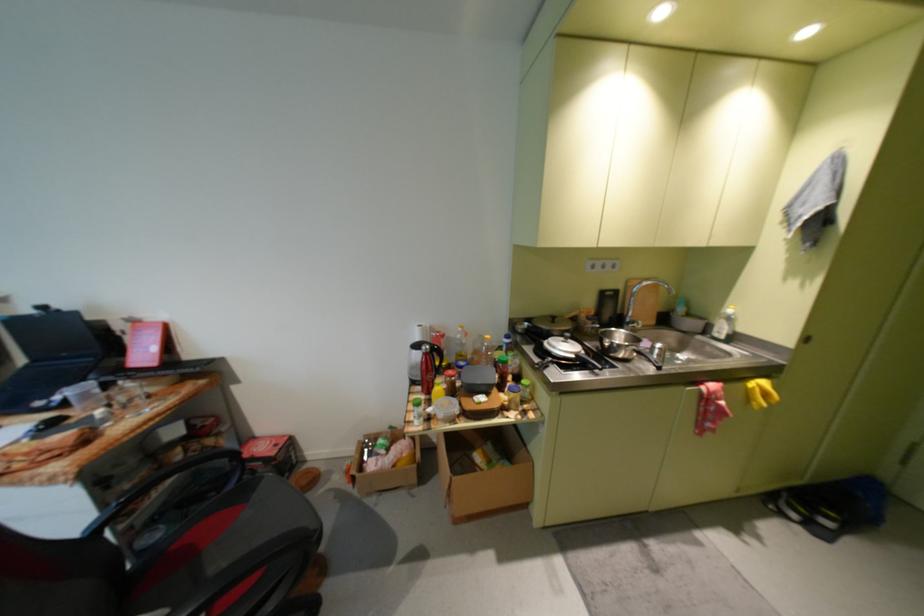
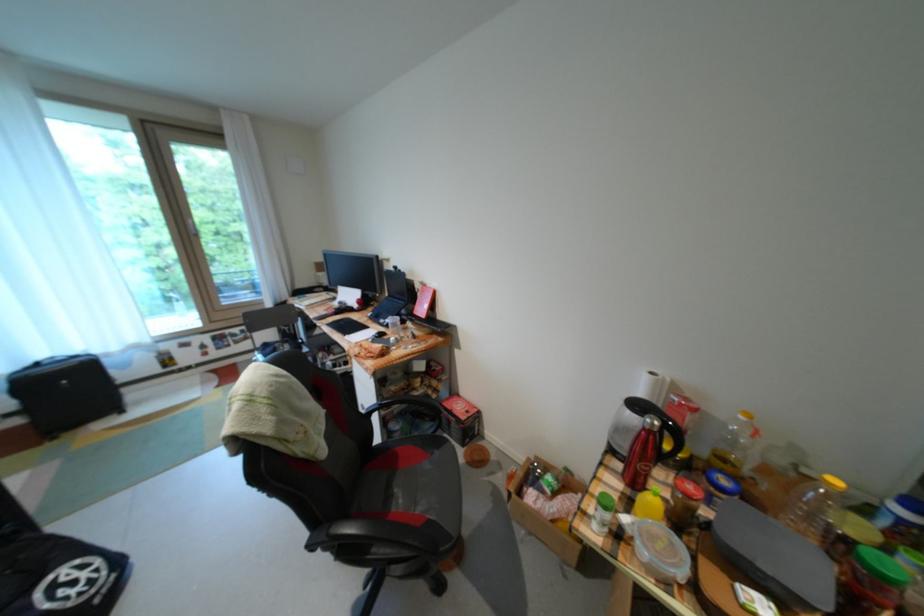
Where in the second image is the point corresponding to (127,511) from the first image?

(387, 407)